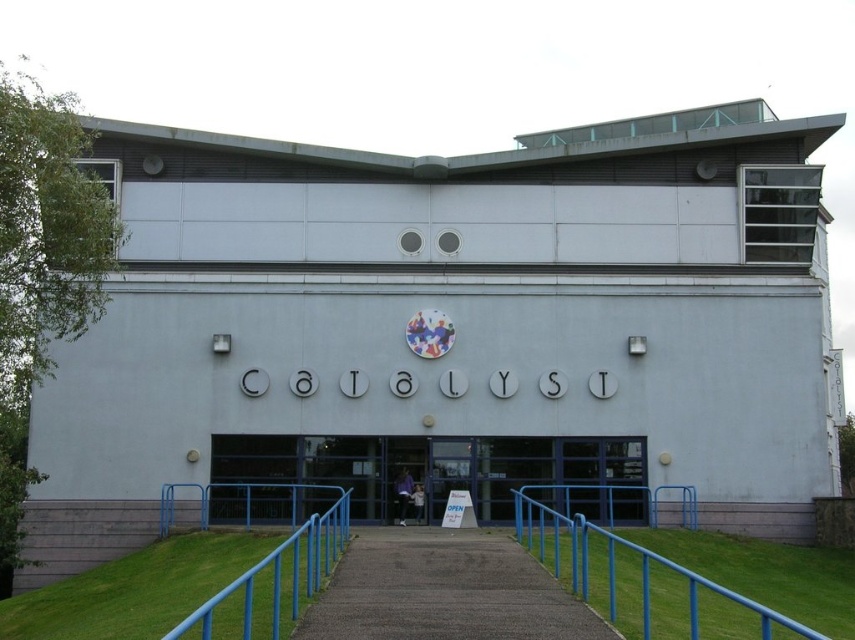
Between concrete paved path at center and blue metal railing at center, which one appears on the left side from the viewer's perspective?

Positioned to the left is blue metal railing at center.

At what (x,y) coordinates should I click in order to perform the action: click on concrete paved path at center. Please return your answer as a coordinate pair (x, y). Looking at the image, I should click on (444, 592).

Between point (367, 621) and point (268, 584), which one is positioned in front?

Point (367, 621) is in front.

Locate an element on the screen. concrete paved path at center is located at coordinates (444, 592).

Who is positioned more to the left, blue metal railing at lower center or blue metal railing at center?

blue metal railing at center is more to the left.

Who is positioned more to the right, blue metal railing at lower center or blue metal railing at center?

blue metal railing at lower center is more to the right.

You are a GUI agent. You are given a task and a screenshot of the screen. Output one action in this format:
    pyautogui.click(x=<x>, y=<y>)
    Task: Click on the blue metal railing at lower center
    The width and height of the screenshot is (855, 640).
    Given the screenshot: What is the action you would take?
    pyautogui.click(x=640, y=579)

This screenshot has width=855, height=640. Find the location of `blue metal railing at lower center`. blue metal railing at lower center is located at coordinates (640, 579).

Which is below, concrete paved path at center or blue metal railing at lower center?

blue metal railing at lower center is below.

Does point (513, 541) lie in front of point (569, 516)?

Yes, it is.

Locate an element on the screen. The width and height of the screenshot is (855, 640). concrete paved path at center is located at coordinates (444, 592).